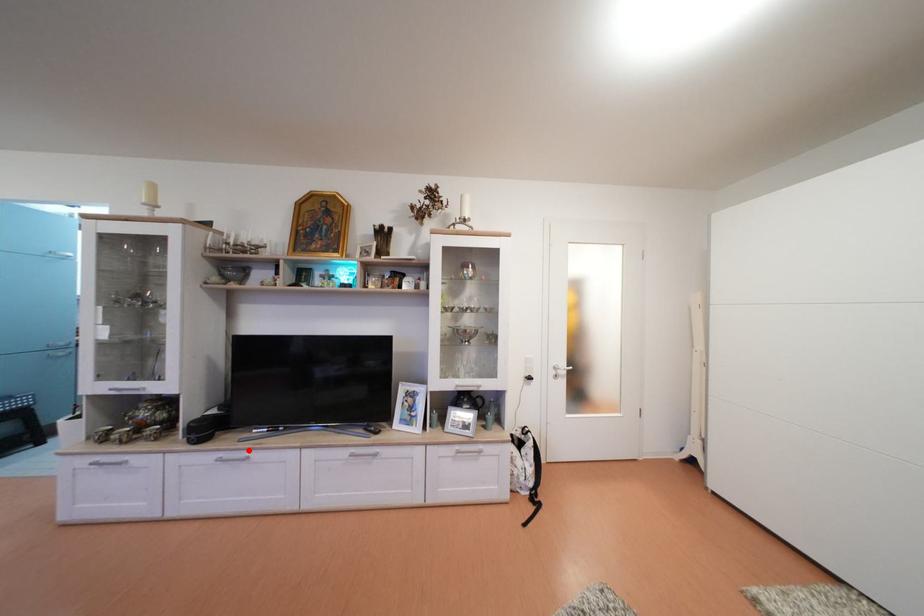
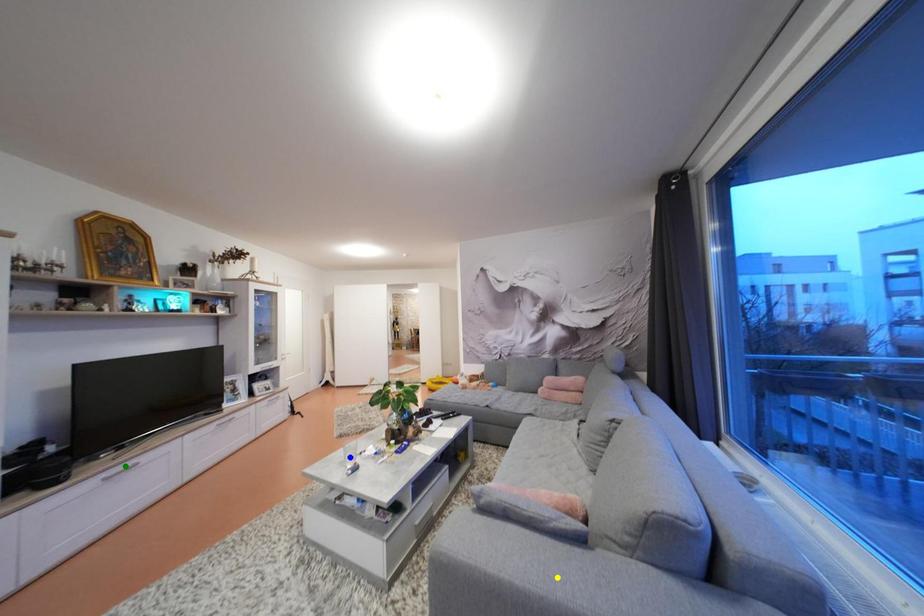
Question: I am providing you with two images of the same scene from different viewpoints. A red point is marked on the first image. You are given multiple points on the second image. Which point in image 2 represents the same 3d spot as the red point in image 1?

Choices:
 (A) green point
 (B) yellow point
 (C) blue point

Answer: (A)